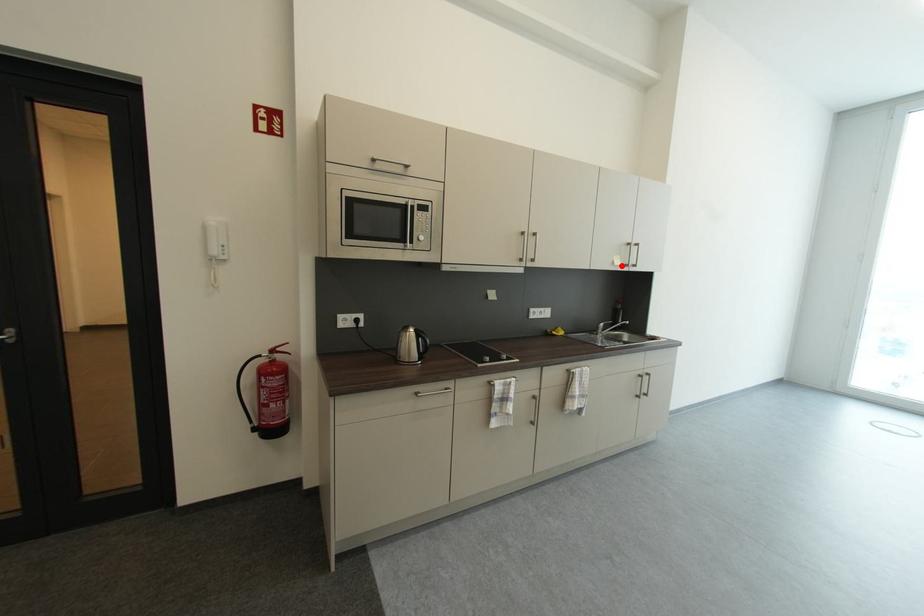
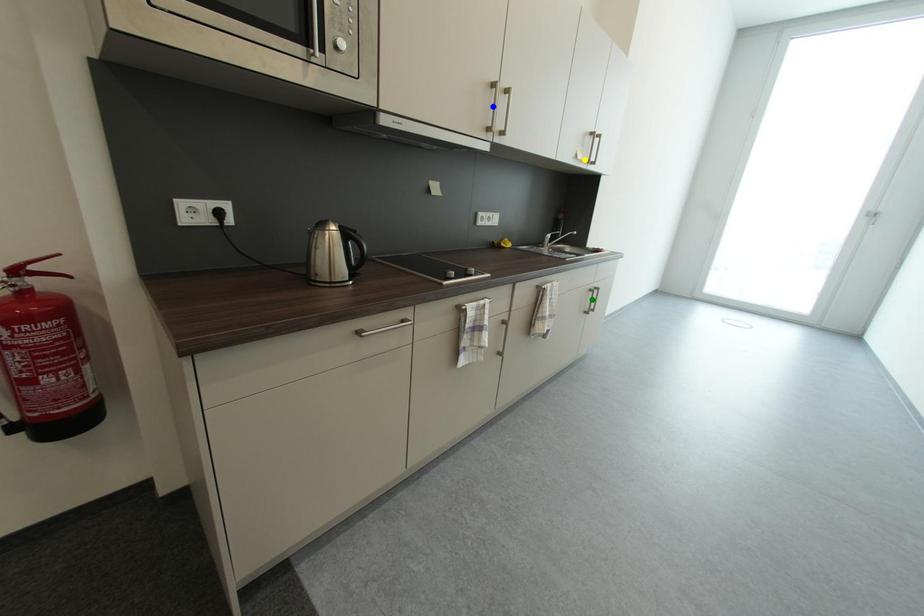
Question: I am providing you with two images of the same scene from different viewpoints. A red point is marked on the first image. You are given multiple points on the second image. Which mark in image 2 goes with the point in image 1?

Choices:
 (A) yellow point
 (B) blue point
 (C) green point

Answer: (A)